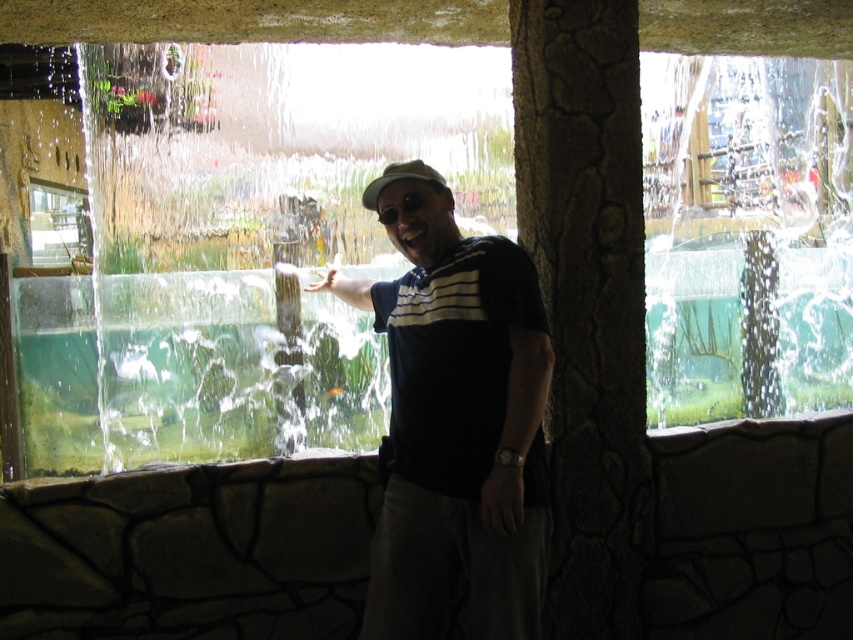
Is point (409, 156) in front of point (51, 243)?

Yes, point (409, 156) is closer to viewer.

Is the position of clear glass water at center less distant than that of clear glass window at center?

Yes, it is in front of clear glass window at center.

Is point (84, 419) less distant than point (38, 188)?

Yes, it is.

The image size is (853, 640). I want to click on clear glass water at center, so click(233, 240).

Is matte black polo shirt at center to the left of clear glass window at center from the viewer's perspective?

Incorrect, matte black polo shirt at center is not on the left side of clear glass window at center.

At what (x,y) coordinates should I click in order to perform the action: click on matte black polo shirt at center. Please return your answer as a coordinate pair (x, y). Image resolution: width=853 pixels, height=640 pixels. Looking at the image, I should click on (456, 424).

What do you see at coordinates (233, 240) in the screenshot?
I see `clear glass water at center` at bounding box center [233, 240].

Does clear glass water at center appear over matte black polo shirt at center?

Actually, clear glass water at center is below matte black polo shirt at center.

Who is more forward, (656,253) or (529,266)?

Point (529,266) is in front.

You are a GUI agent. You are given a task and a screenshot of the screen. Output one action in this format:
    pyautogui.click(x=<x>, y=<y>)
    Task: Click on the clear glass water at center
    
    Given the screenshot: What is the action you would take?
    pyautogui.click(x=233, y=240)